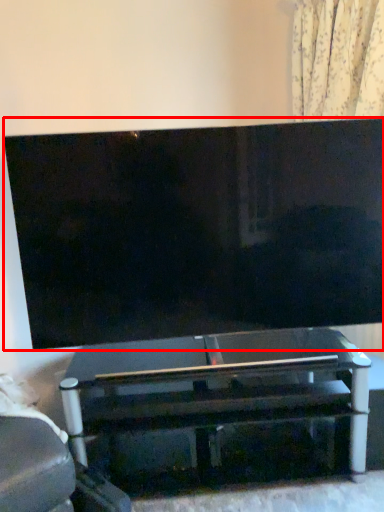
Question: From the image's perspective, where is television (annotated by the red box) located relative to table?

Choices:
 (A) above
 (B) below

Answer: (A)